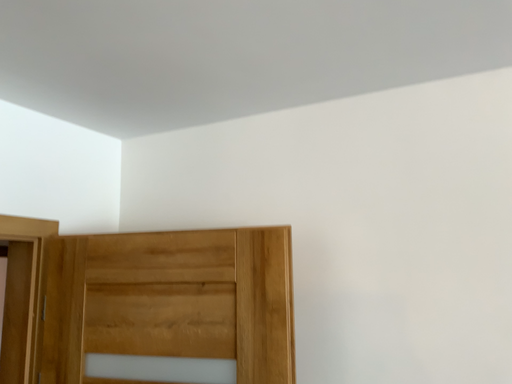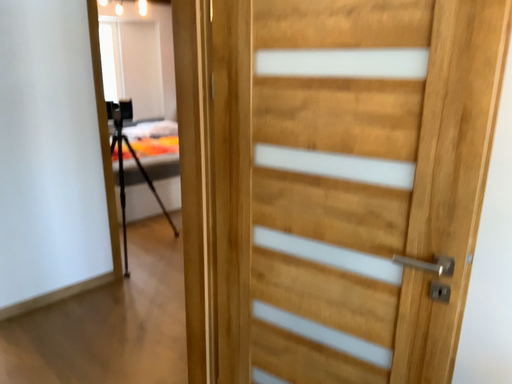
Question: How did the camera likely rotate when shooting the video?

Choices:
 (A) rotated left
 (B) rotated right

Answer: (A)